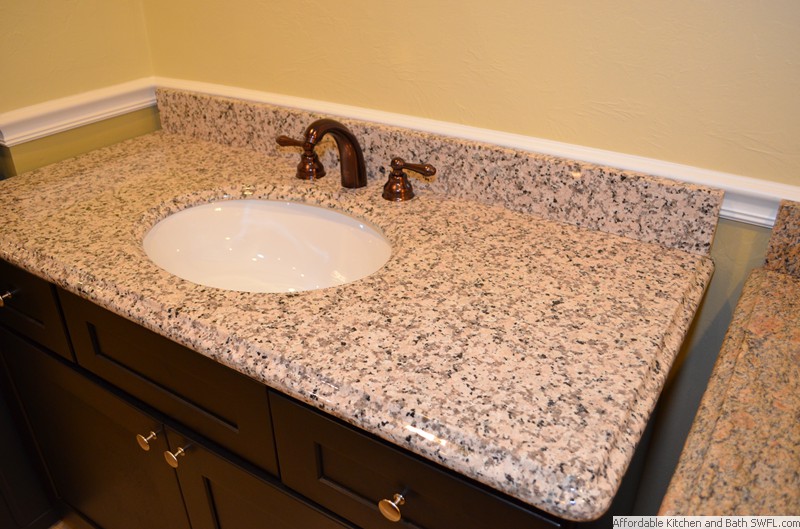
Find the location of a particular element. Image resolution: width=800 pixels, height=529 pixels. handles is located at coordinates (394, 504), (168, 465), (141, 446), (1, 302).